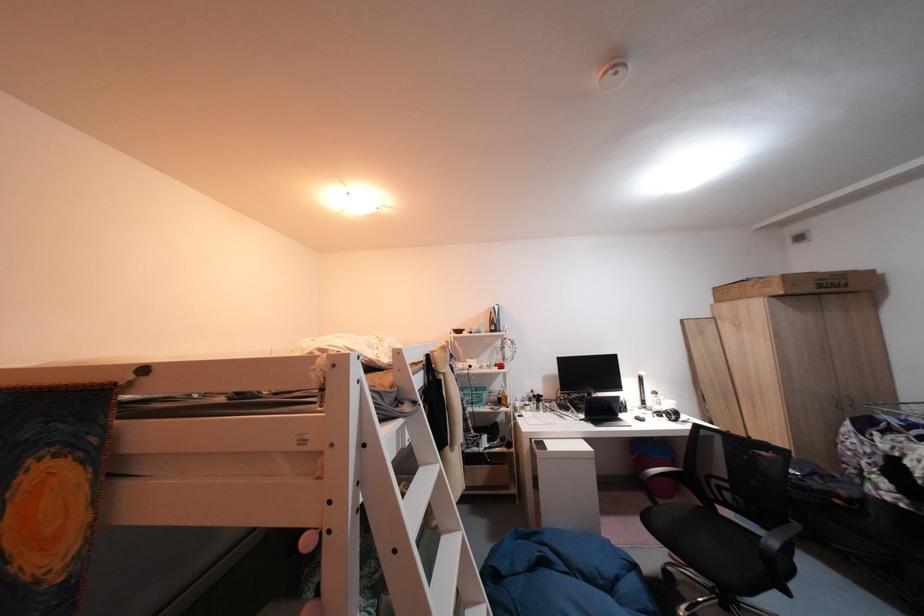
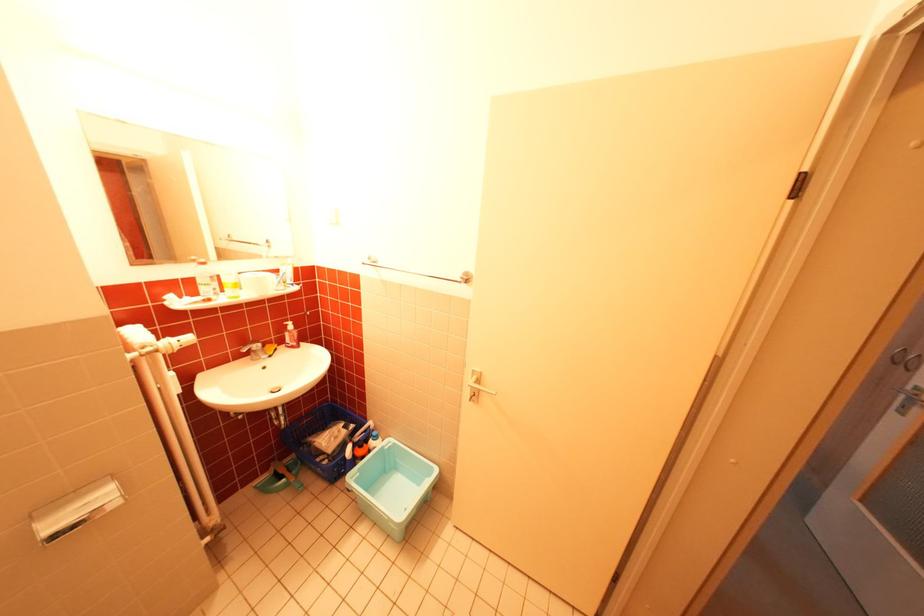
Question: I am providing you with two images of the same scene from different viewpoints. Which of the following objects are not visible in image2?

Choices:
 (A) white radiator valve
 (B) light fixture cage
 (C) orange spray trigger
 (D) black laptop computer

Answer: (D)